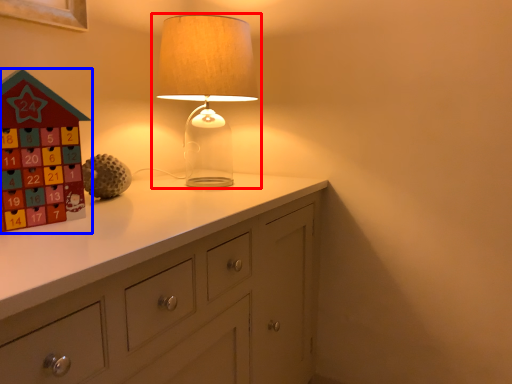
Question: Which point is closer to the camera, lamp (highlighted by a red box) or toy (highlighted by a blue box)?

Choices:
 (A) lamp
 (B) toy

Answer: (B)